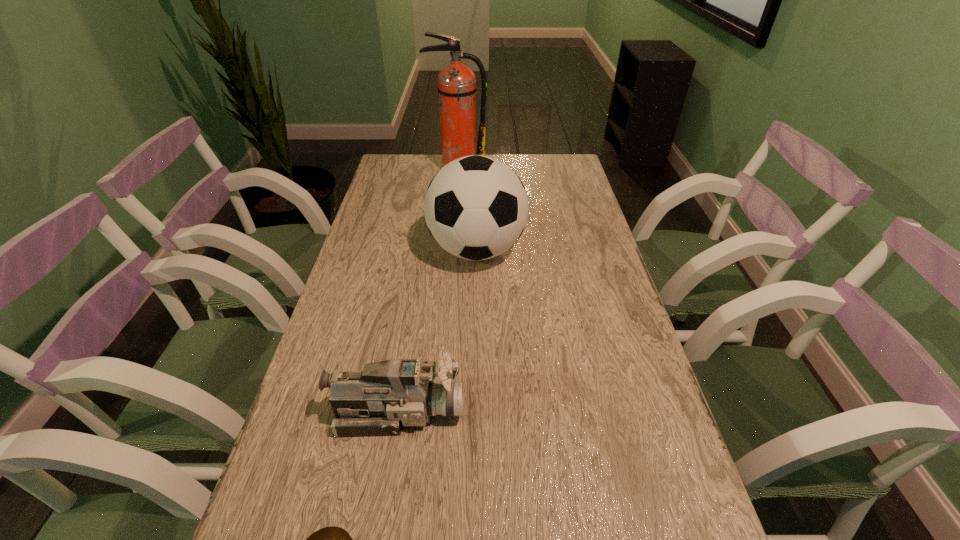
This screenshot has height=540, width=960. Identify the location of the tallest object. (456, 82).

Identify the location of the farthest object. The height and width of the screenshot is (540, 960). (456, 82).

In order to click on the third shortest object in this screenshot , I will do `click(476, 207)`.

At what (x,y) coordinates should I click in order to perform the action: click on the third nearest object. Please return your answer as a coordinate pair (x, y). Image resolution: width=960 pixels, height=540 pixels. Looking at the image, I should click on (476, 207).

You are a GUI agent. You are given a task and a screenshot of the screen. Output one action in this format:
    pyautogui.click(x=<x>, y=<y>)
    Task: Click on the third farthest object
    
    Given the screenshot: What is the action you would take?
    pyautogui.click(x=384, y=396)

Locate an element on the screen. Image resolution: width=960 pixels, height=540 pixels. camcorder is located at coordinates (384, 396).

Where is `free spot located at the nozzle of the fire extinguisher`? The width and height of the screenshot is (960, 540). free spot located at the nozzle of the fire extinguisher is located at coordinates (453, 216).

Locate an element on the screen. The image size is (960, 540). free space located 0.160m on the right of the second farthest object is located at coordinates (580, 250).

Locate an element on the screen. vacant area located on the front-facing side of the camcorder is located at coordinates (608, 411).

Locate an element on the screen. The image size is (960, 540). object that is at the far edge is located at coordinates (456, 82).